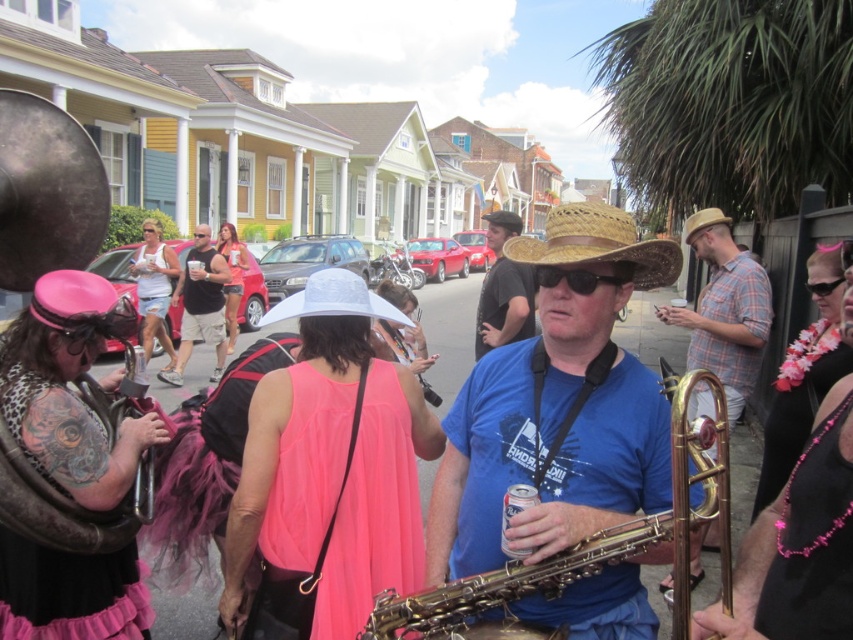
Question: Which point appears closest to the camera in this image?

Choices:
 (A) (7, 561)
 (B) (637, 243)
 (C) (712, 221)
 (D) (727, 410)

Answer: (B)

Question: Which point is closer to the camera?

Choices:
 (A) (337, 499)
 (B) (755, 321)
 (C) (383, 314)
 (D) (111, 332)

Answer: (A)

Question: Which of these objects is positioned farthest from the pink beaded lei at right?

Choices:
 (A) blue fabric shirt at center
 (B) black leather bag at left
 (C) pink chiffon dress at center

Answer: (B)

Question: Does plaid shirt at right appear on the left side of white straw hat at center?

Choices:
 (A) yes
 (B) no

Answer: (B)

Question: Does blue fabric shirt at center appear on the right side of black leather bag at left?

Choices:
 (A) yes
 (B) no

Answer: (A)

Question: Does blue fabric shirt at center have a smaller size compared to pink fabric straw hat at upper left?

Choices:
 (A) yes
 (B) no

Answer: (B)